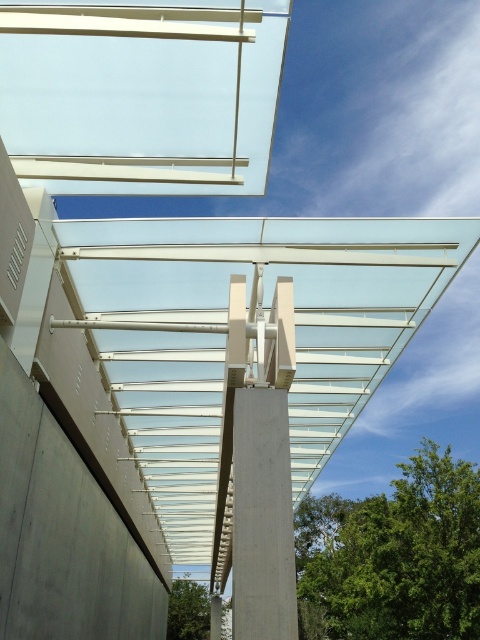
Does transparent glass roof at upper center appear on the left side of gray concrete wall at lower left?

Incorrect, transparent glass roof at upper center is not on the left side of gray concrete wall at lower left.

Can you confirm if transparent glass roof at upper center is shorter than gray concrete wall at lower left?

Correct, transparent glass roof at upper center is not as tall as gray concrete wall at lower left.

Where is `transparent glass roof at upper center`? transparent glass roof at upper center is located at coordinates (141, 93).

At what (x,y) coordinates should I click in order to perform the action: click on transparent glass roof at upper center. Please return your answer as a coordinate pair (x, y). Image resolution: width=480 pixels, height=640 pixels. Looking at the image, I should click on (141, 93).

Does transparent glass roof at upper center appear on the right side of concrete pillar at center?

No, transparent glass roof at upper center is not to the right of concrete pillar at center.

Does point (69, 129) come behind point (276, 468)?

Yes.

Which is behind, point (239, 134) or point (291, 634)?

The point (239, 134) is more distant.

At what (x,y) coordinates should I click in order to perform the action: click on transparent glass roof at upper center. Please return your answer as a coordinate pair (x, y). The height and width of the screenshot is (640, 480). Looking at the image, I should click on (141, 93).

Does point (13, 525) lie behind point (292, 572)?

Yes, it is.

Can you confirm if gray concrete wall at lower left is positioned below concrete pillar at center?

Yes.

Which is behind, point (110, 577) or point (256, 428)?

The point (110, 577) is more distant.

Where is `gray concrete wall at lower left`? The width and height of the screenshot is (480, 640). gray concrete wall at lower left is located at coordinates (62, 534).